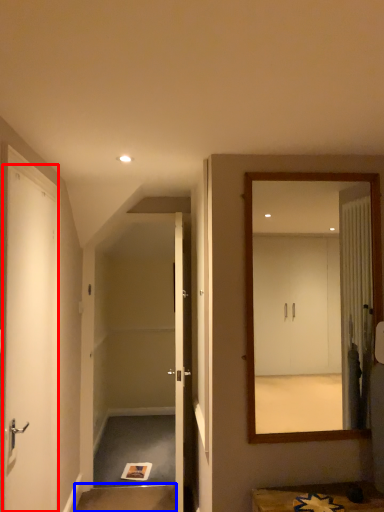
Question: Which object is further to the camera taking this photo, door (highlighted by a red box) or stair (highlighted by a blue box)?

Choices:
 (A) door
 (B) stair

Answer: (B)